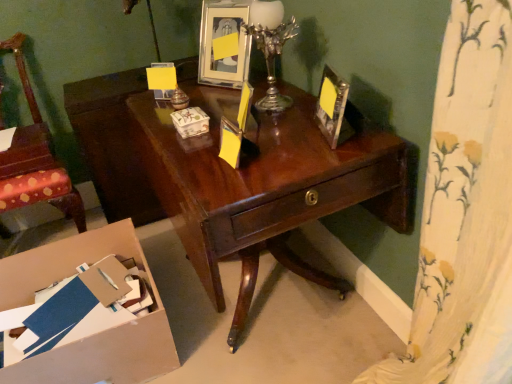
Question: Considering their positions, is metallic silver picture frame at upper right, the second picture frame positioned from the back, located in front of or behind silver metallic candle holder at upper right?

Choices:
 (A) behind
 (B) front

Answer: (B)

Question: In terms of height, does metallic silver picture frame at upper right, the second picture frame positioned from the back, look taller or shorter compared to silver metallic candle holder at upper right?

Choices:
 (A) short
 (B) tall

Answer: (A)

Question: Considering the real-world distances, which object is farthest from the silver metallic candle holder at upper right?

Choices:
 (A) metallic silver picture frame at upper right, arranged as the first picture frame when viewed from the right
 (B) wooden chair at left
 (C) metallic silver picture frame at upper center, which is the second picture frame from bottom to top
 (D) matte ceramic box at center
 (E) shiny dark wood desk at center

Answer: (B)

Question: Which of these objects is positioned closest to the wooden chair at left?

Choices:
 (A) matte ceramic box at center
 (B) metallic silver picture frame at upper right, acting as the second picture frame starting from the top
 (C) shiny dark wood desk at center
 (D) silver metallic candle holder at upper right
 (E) cardboard box at lower left

Answer: (E)